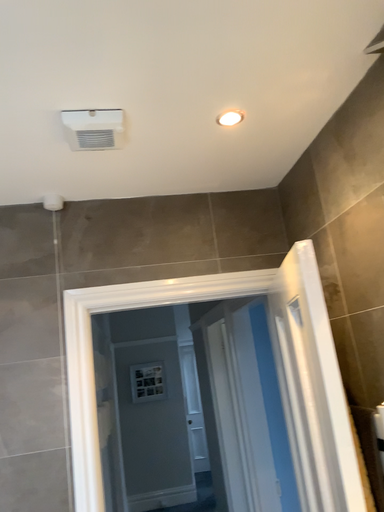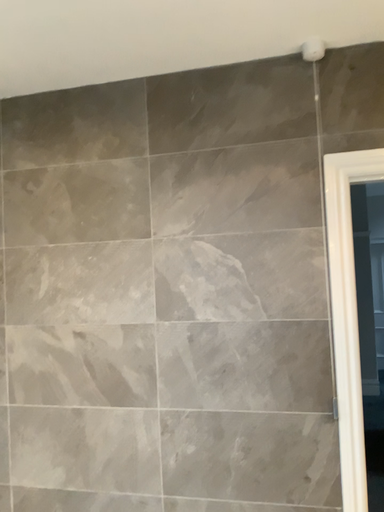
Question: Which way did the camera rotate in the video?

Choices:
 (A) rotated left
 (B) rotated right

Answer: (A)